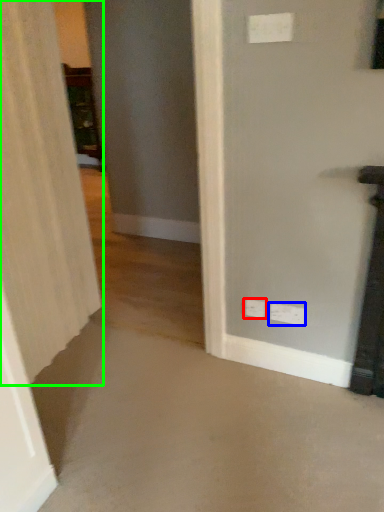
Question: Considering the real-world distances, which object is farthest from electric outlet (highlighted by a red box)? electric outlet (highlighted by a blue box) or curtain (highlighted by a green box)?

Choices:
 (A) electric outlet
 (B) curtain

Answer: (B)